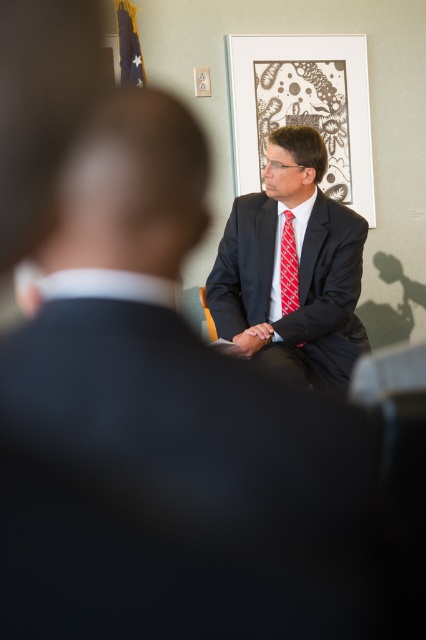
You are a photographer setting up for a formal event. You need to ensure that the matte black suit at center and the red checkered tie at center are both visible in the frame. Given their sizes, which object should you focus on to ensure both are in focus?

The matte black suit at center is wider than the red checkered tie at center, so focusing on the matte black suit at center will ensure both are in focus as it covers a larger area.

You are standing in the room and see two points marked in the scene. Which point is closer to you, point (281, 113) or point (282, 301)?

Answer: Point (281, 113) is closer to you than point (282, 301).

You are a photographer trying to capture a closeup of the artwork on the wall. You have two points marked in the scene, point 1 at coordinates point (293,138) and point 2 at coordinates point (290,225). Which point should you focus on to ensure the artwork is in focus?

Point (293,138) is closer to the camera than point (290,225), so focusing on point 1 will ensure the artwork is in focus.